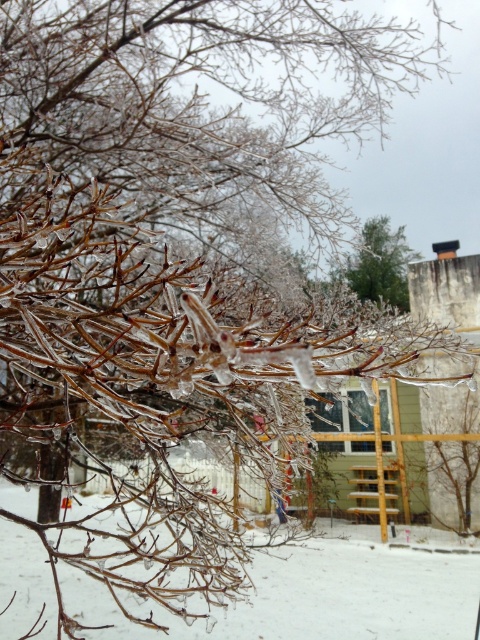
From the picture: Which is more to the left, white frosty snow at lower left or green matte tree at upper center?

white frosty snow at lower left is more to the left.

Based on the photo, who is positioned more to the right, white frosty snow at lower left or green matte tree at upper center?

green matte tree at upper center is more to the right.

Find the location of a particular element. The height and width of the screenshot is (640, 480). white frosty snow at lower left is located at coordinates (317, 595).

This screenshot has height=640, width=480. In order to click on white frosty snow at lower left in this screenshot , I will do `click(317, 595)`.